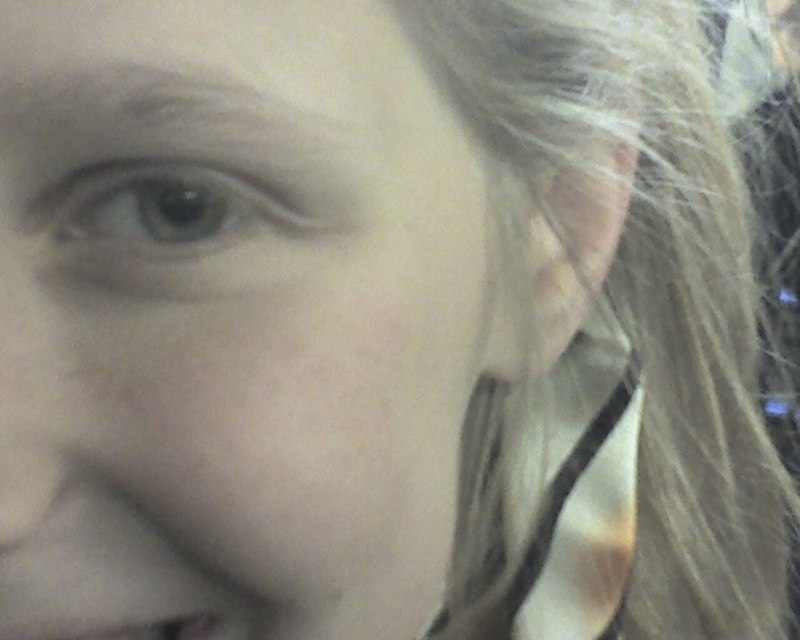
You are a photographer adjusting the lighting for a portrait. The subject has smooth skin at center and blonde hair at right. You need to ensure the lighting highlights both features equally. Given their sizes, which feature might require more focused lighting adjustments?

The smooth skin at center has a smaller width than the blonde hair at right. To ensure equal highlighting, the lighting adjustments should focus more on the blonde hair at right due to its larger size.

Based on the scene description, which object is wider, the smooth skin at center or the green matte eye at upper left?

The smooth skin at center is wider than the green matte eye at upper left according to the description.

Based on the scene description, where is the smooth skin at center located in the image?

The smooth skin at center is located at point coordinates of approximately 0.467 on the x axis and 0.302 on the y axis.